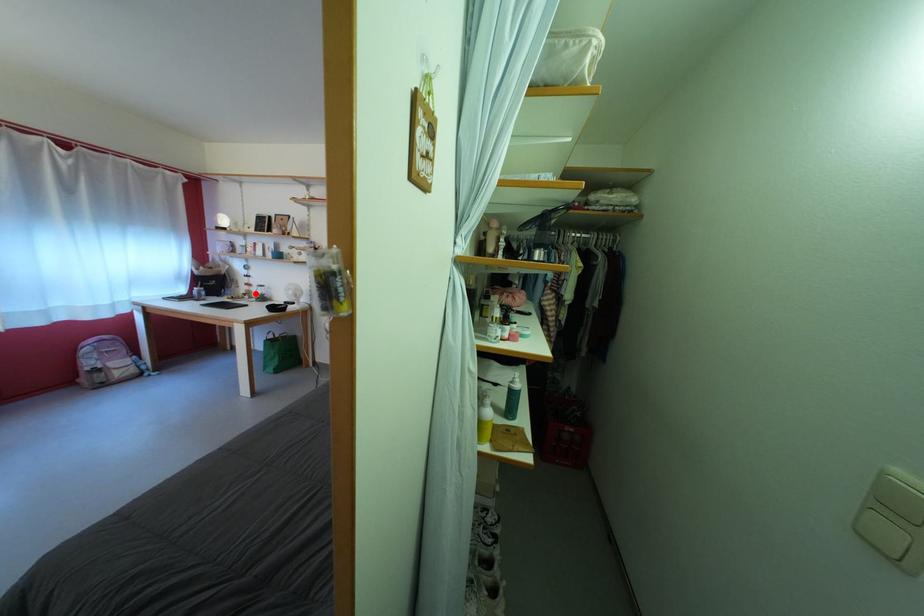
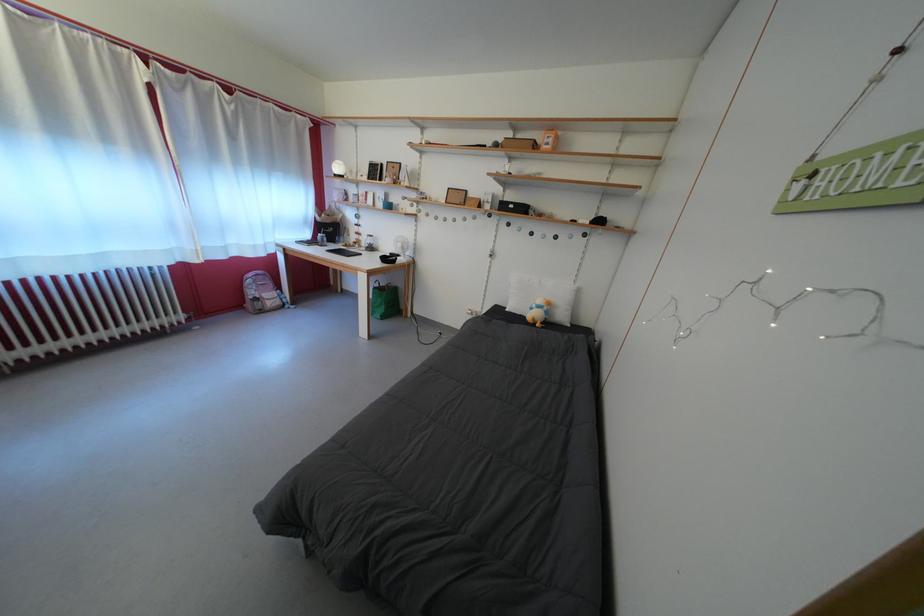
Locate, in the second image, the point that corresponds to the highlighted location in the first image.

(365, 243)